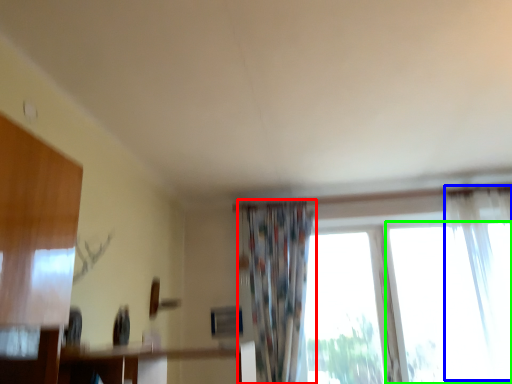
Question: Which is farther away from curtain (highlighted by a red box)? curtain (highlighted by a blue box) or window (highlighted by a green box)?

Choices:
 (A) curtain
 (B) window

Answer: (A)